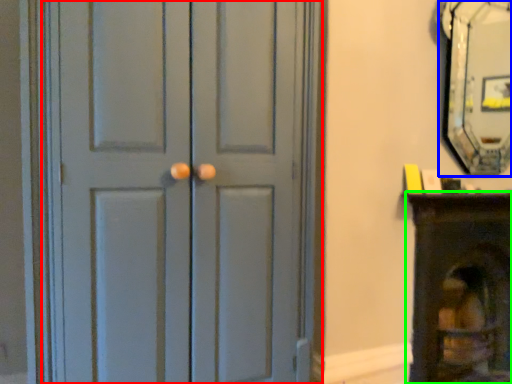
Question: Which object is positioned closest to door (highlighted by a red box)? Select from fireplace (highlighted by a blue box) and furniture (highlighted by a green box).

Choices:
 (A) fireplace
 (B) furniture

Answer: (B)